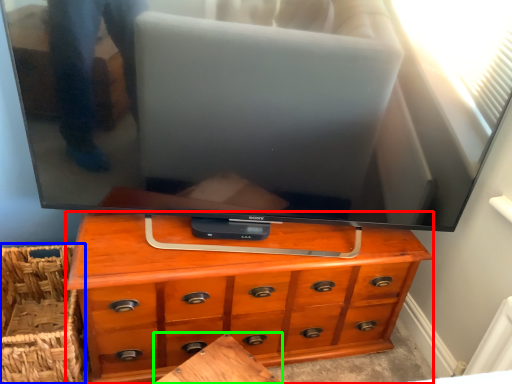
Question: Estimate the real-world distances between objects in this image. Which object is closer to chest of drawers (highlighted by a red box), basket (highlighted by a blue box) or table (highlighted by a green box)?

Choices:
 (A) basket
 (B) table

Answer: (B)